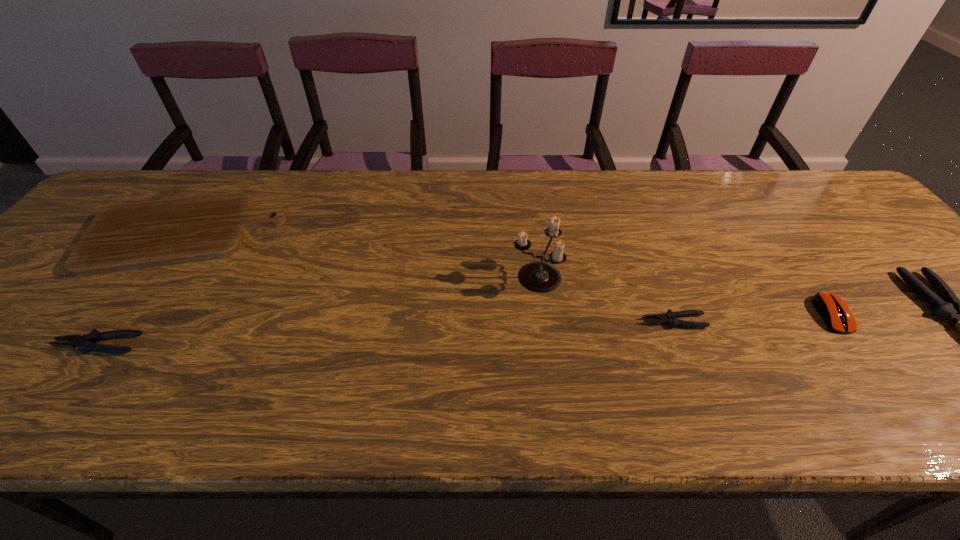
To ensure equal spacing by inserting another pliers among them, please point out a vacant spot for this new pliers. Please provide its 2D coordinates. Your answer should be formatted as a tuple, i.e. [(x, y)], where the tuple contains the x and y coordinates of a point satisfying the conditions above.

[(393, 333)]